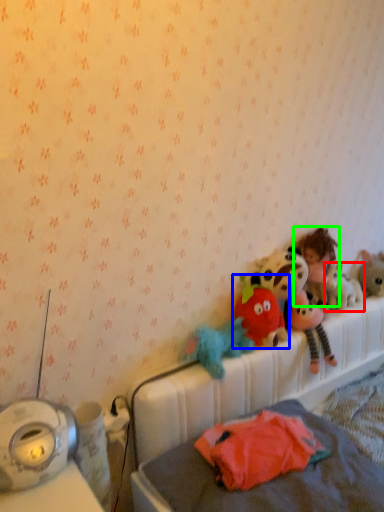
Question: Based on their relative distances, which object is nearer to toy (highlighted by a red box)? Choose from toy (highlighted by a blue box) and person (highlighted by a green box).

Choices:
 (A) toy
 (B) person

Answer: (B)